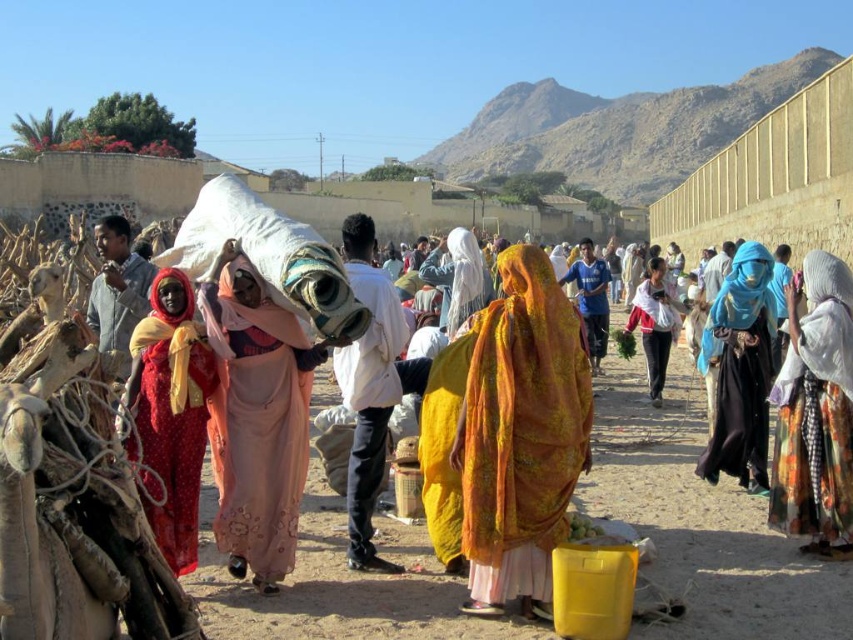
Question: Can you confirm if floral fabric dress at center is positioned above white cotton bag at center?

Choices:
 (A) yes
 (B) no

Answer: (B)

Question: Which point is farther from the camera taking this photo?

Choices:
 (A) (241, 563)
 (B) (837, 554)

Answer: (A)

Question: Which point is closer to the camera?

Choices:
 (A) (495, 380)
 (B) (780, 387)
 (C) (299, 362)

Answer: (A)

Question: Does matte pink dress at center have a lesser width compared to matte red dress at center?

Choices:
 (A) yes
 (B) no

Answer: (B)

Question: Which object is positioned farthest from the yellow-orange fabric at center?

Choices:
 (A) floral fabric dress at center
 (B) blue sheer scarf at center
 (C) white cotton bag at center
 (D) white fabric headscarf at center

Answer: (C)

Question: Can you confirm if blue sheer scarf at center is bigger than white fabric headscarf at center?

Choices:
 (A) yes
 (B) no

Answer: (B)